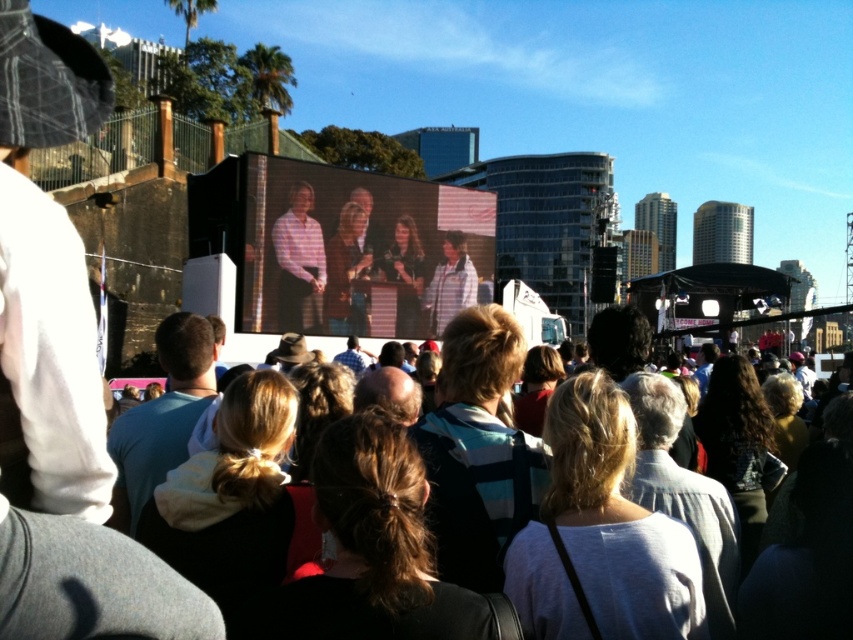
You are a photographer at the event and need to capture a clear shot of the light brown hair at center on the large screen. Based on their position, can you estimate whether they are standing to the left or right side of the screen?

The light brown hair at center is located at point 0.713 on the x and 0.846 on the y axis, so they are positioned towards the right side of the screen.

You are a photographer trying to capture a clear shot of the light brown hair at center and the matte screen at center. Which object is narrower in width?

The matte screen at center is thinner than the light brown hair at center, so the matte screen at center is narrower in width.

You are attending an outdoor event and want to watch the live broadcast on the matte screen at center. Where should you stand to see it clearly?

You should stand facing the matte screen at center located at point (x=358, y=250) to see it clearly.